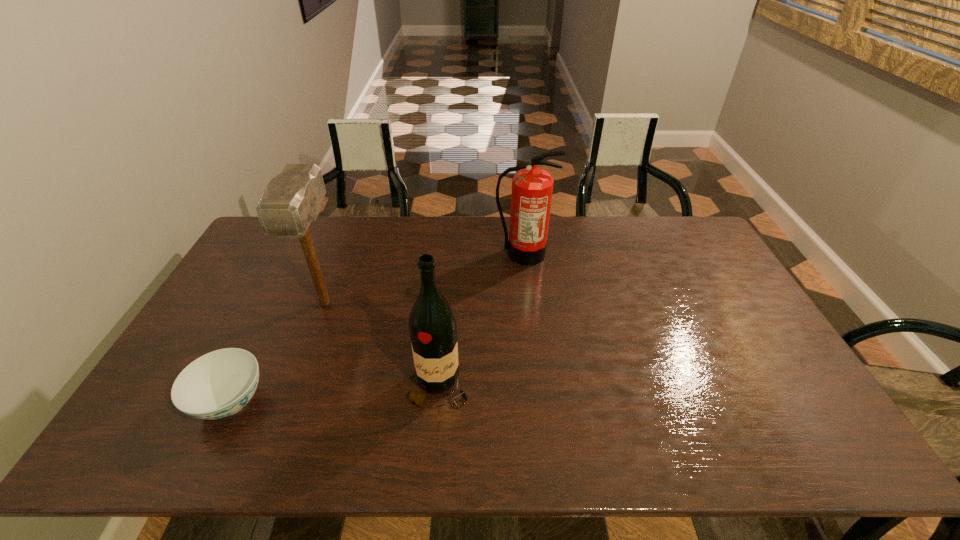
Where is `the second farthest object`? the second farthest object is located at coordinates (292, 199).

I want to click on mallet, so click(x=292, y=199).

Find the location of a particular element. The width and height of the screenshot is (960, 540). the third object from left to right is located at coordinates (433, 331).

Where is `the rightmost object`? the rightmost object is located at coordinates (532, 187).

Where is `the farthest object`? The width and height of the screenshot is (960, 540). the farthest object is located at coordinates (532, 187).

Identify the location of the leftmost object. The height and width of the screenshot is (540, 960). (218, 384).

I want to click on chinaware, so click(218, 384).

Find the location of a particular element. This screenshot has height=540, width=960. vacant space situated on the striking face of the mallet is located at coordinates (276, 434).

In order to click on vacant space situated 0.080m on the surface of the third object from left to right in this screenshot , I will do `click(435, 444)`.

Where is `vacant space located on the front side of the fire extinguisher`? vacant space located on the front side of the fire extinguisher is located at coordinates (529, 305).